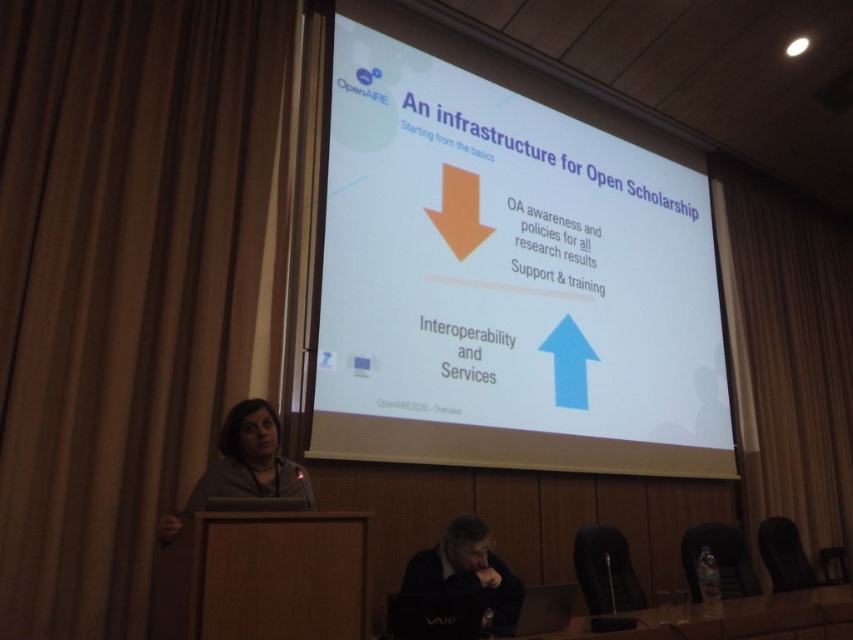
You are an attendee sitting in the front row of the conference room. You want to take a photo of the white matte projector screen at center but need to avoid the brown fabric curtain at left from appearing in the frame. Is the curtain likely blocking your view of the screen?

The white matte projector screen at center is further to the viewer than the brown fabric curtain at left, so the curtain is behind the screen. Therefore, the curtain will not block the screen in your photo.

You are a presenter standing 2 meters away from the white matte projector screen at center. You need to move to a position where you can see both the audience and the screen clearly. The camera is positioned 3.49 meters away from the screen. Is the current distance between you and the screen sufficient for you to see both the audience and the screen without obstruction?

The white matte projector screen at center and camera are 3.49 meters apart from each other. Since you are standing 2 meters away from the screen, you are closer to it than the camera. This distance may be too close to see the audience clearly while facing the screen. Consider moving further back to a position between 3.49 meters and the audience to ensure both are visible.